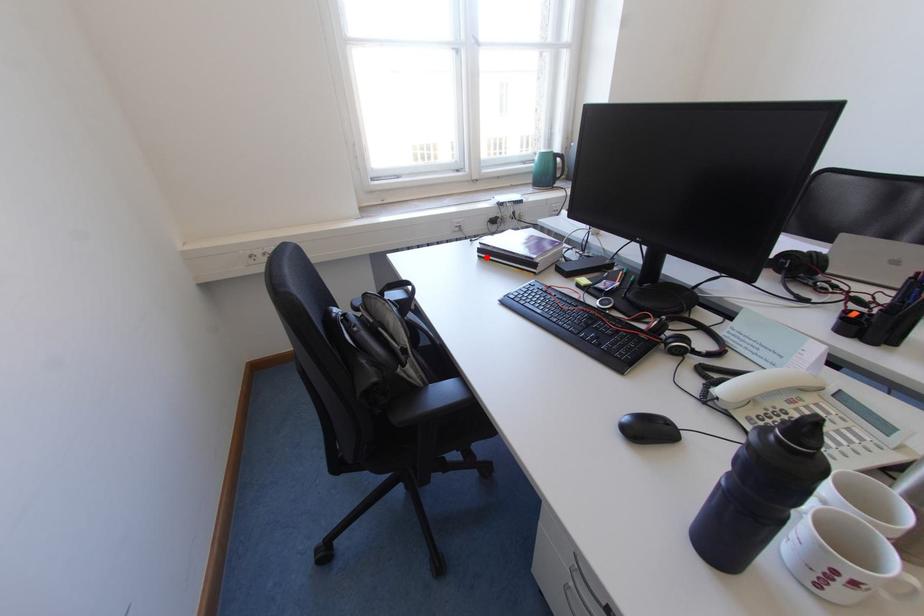
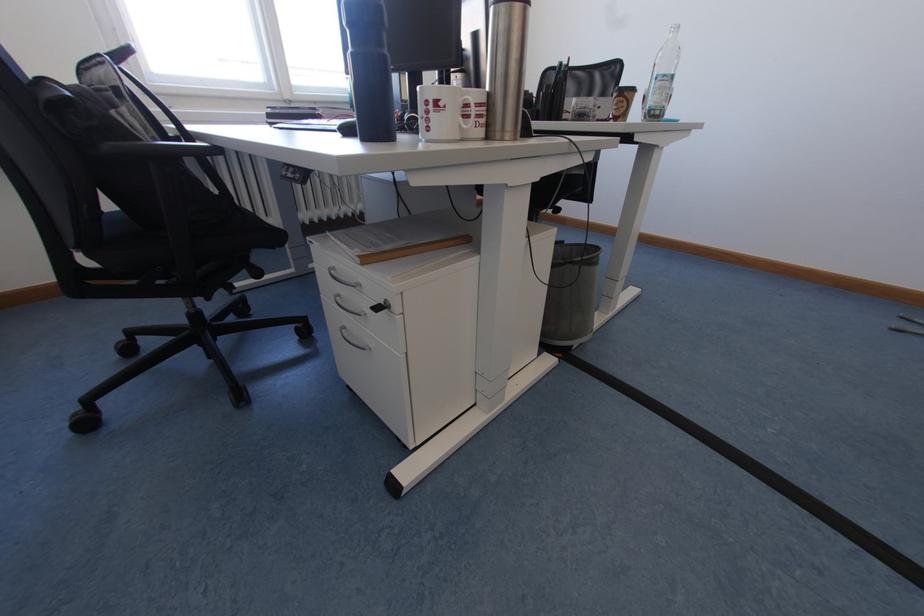
Question: I am providing you with two images of the same scene from different viewpoints. A red point is marked on the first image. Is the red point's position out of view in image 2?

Choices:
 (A) Yes
 (B) No

Answer: (A)